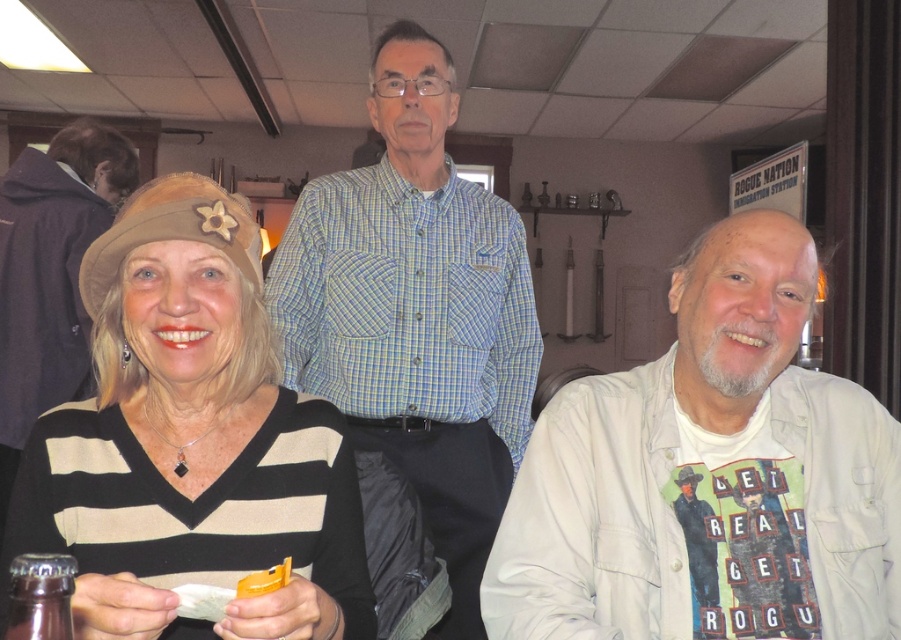
Does white cotton shirt at right appear on the left side of matte brown hat at left?

No, white cotton shirt at right is not to the left of matte brown hat at left.

Which of these two, white cotton shirt at right or matte brown hat at left, stands shorter?

With less height is matte brown hat at left.

The height and width of the screenshot is (640, 901). Identify the location of white cotton shirt at right. (699, 472).

Which is in front, point (526, 304) or point (23, 564)?

Point (23, 564)

Is light blue plaid shirt at center above brown glass bottle at lower left?

Yes.

The width and height of the screenshot is (901, 640). What do you see at coordinates (417, 314) in the screenshot? I see `light blue plaid shirt at center` at bounding box center [417, 314].

What are the coordinates of `light blue plaid shirt at center` in the screenshot? It's located at (417, 314).

Which is behind, point (307, 465) or point (341, 250)?

The point (341, 250) is behind.

Is point (247, 321) positioned before point (465, 372)?

Yes, point (247, 321) is closer to viewer.

Where is `matte brown hat at left`? The image size is (901, 640). matte brown hat at left is located at coordinates (190, 442).